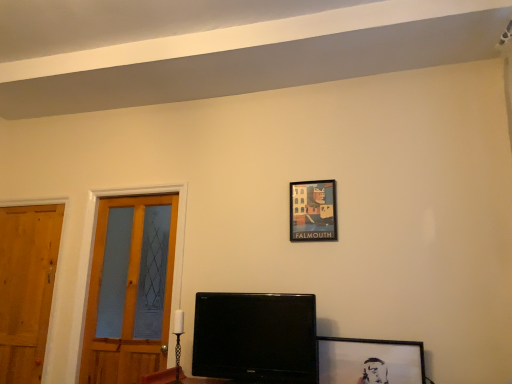
Question: Is wooden door at left, placed as the 2th door when sorted from left to right, at the back of wooden door at left, the second door viewed from the right?

Choices:
 (A) yes
 (B) no

Answer: (B)

Question: Is wooden door at left, the second door viewed from the right, wider than wooden door at left, placed as the 2th door when sorted from left to right?

Choices:
 (A) yes
 (B) no

Answer: (B)

Question: Is wooden door at left, positioned as the first door in left-to-right order, beside wooden door at left, which appears as the 1th door when viewed from the right?

Choices:
 (A) yes
 (B) no

Answer: (B)

Question: Considering the relative sizes of wooden door at left, the second door viewed from the right, and wooden door at left, placed as the 2th door when sorted from left to right, in the image provided, is wooden door at left, the second door viewed from the right, taller than wooden door at left, placed as the 2th door when sorted from left to right,?

Choices:
 (A) yes
 (B) no

Answer: (B)

Question: Considering the relative positions of wooden door at left, positioned as the first door in left-to-right order, and wooden door at left, which appears as the 1th door when viewed from the right, in the image provided, is wooden door at left, positioned as the first door in left-to-right order, behind wooden door at left, which appears as the 1th door when viewed from the right,?

Choices:
 (A) yes
 (B) no

Answer: (A)

Question: Does matte paper picture frame at upper center, the 2th picture frame in the front-to-back sequence, touch black glossy monitor at center?

Choices:
 (A) no
 (B) yes

Answer: (A)

Question: Does matte paper picture frame at upper center, the first picture frame from the top, have a lesser height compared to black glossy monitor at center?

Choices:
 (A) yes
 (B) no

Answer: (A)

Question: Would you say matte paper picture frame at upper center, the first picture frame from the back, contains black glossy monitor at center?

Choices:
 (A) no
 (B) yes

Answer: (A)

Question: Is matte paper picture frame at upper center, the 2th picture frame in the front-to-back sequence, thinner than black glossy monitor at center?

Choices:
 (A) yes
 (B) no

Answer: (A)

Question: From the image's perspective, does matte paper picture frame at upper center, the first picture frame from the back, appear higher than black glossy monitor at center?

Choices:
 (A) yes
 (B) no

Answer: (A)

Question: Is matte paper picture frame at upper center, the first picture frame from the back, turned away from black glossy monitor at center?

Choices:
 (A) yes
 (B) no

Answer: (B)

Question: Does black glossy monitor at center have a greater height compared to matte paper picture frame at upper center, the first picture frame from the back?

Choices:
 (A) yes
 (B) no

Answer: (A)